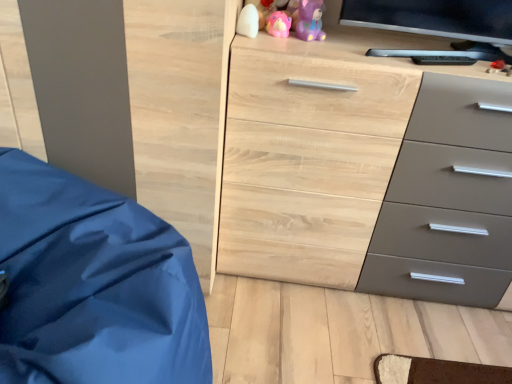
This screenshot has width=512, height=384. I want to click on free location in front of purple matte bear at upper center, acting as the first toy starting from the right, so click(x=310, y=46).